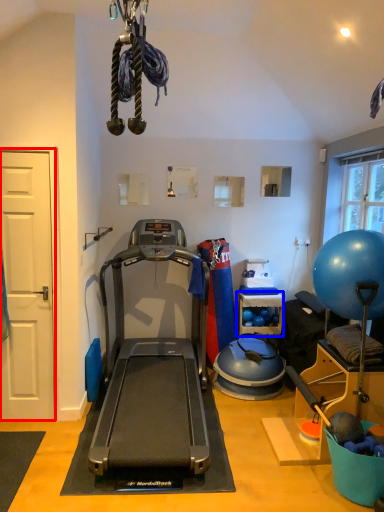
Question: Among these objects, which one is nearest to the camera, door (highlighted by a red box) or shelf (highlighted by a blue box)?

Choices:
 (A) door
 (B) shelf

Answer: (A)